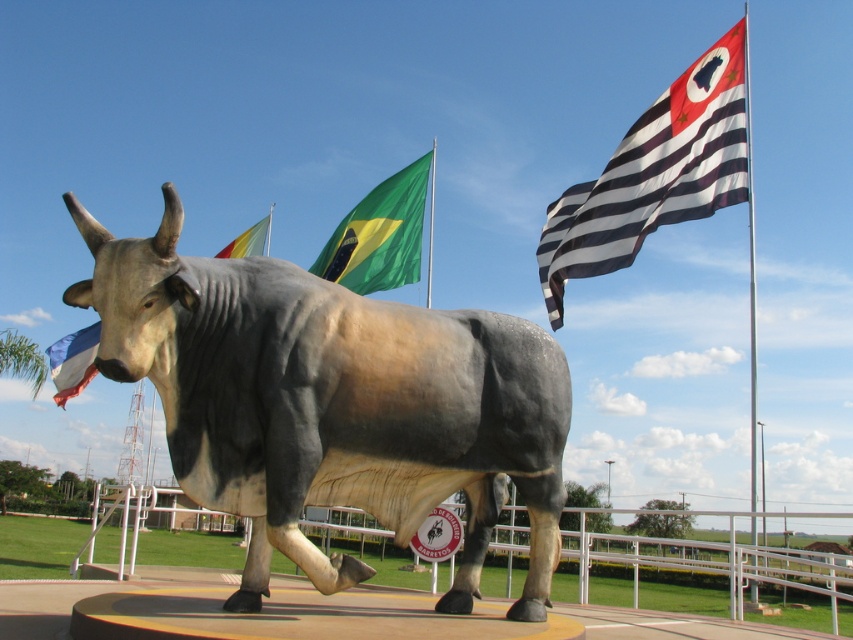
You are an observer standing in front of the statue of a bull. You notice two flags in the scene. Which flag is positioned lower in the image, the blue fabric flag at lower left or the green fabric flag pole at center?

The blue fabric flag at lower left is located below the green fabric flag pole at center, so it is positioned lower in the image.

You are standing at the center of the statue of the bull. You want to walk to the blue fabric flag at lower left. Which direction should you face to walk straight towards it?

You should face the lower left direction to walk straight towards the blue fabric flag at lower left.

Based on the photo, you are an event planner setting up a booth near the statue of a bull. You need to place a 2m wide banner between the black and white striped flag at upper right and the polyester flag at upper center. Can the banner fit between them?

The black and white striped flag at upper right is smaller than the polyester flag at upper center, but the distance between them isn not specified in the description. Therefore, it is unclear if the banner will fit.